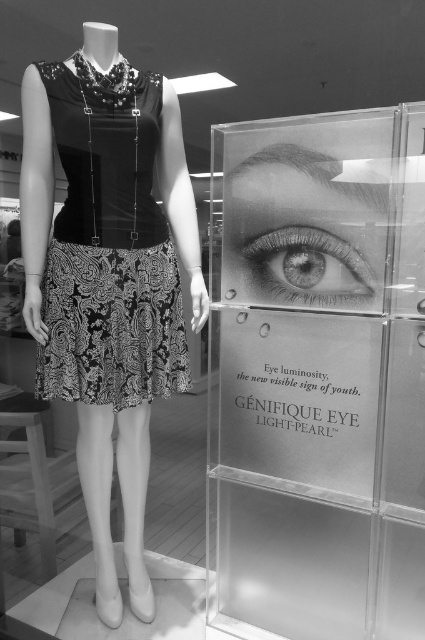
Question: Does transparent acrylic at right appear on the right side of black satin dress at center?

Choices:
 (A) yes
 (B) no

Answer: (A)

Question: Estimate the real-world distances between objects in this image. Which object is farther from the black satin dress at center?

Choices:
 (A) transparent acrylic at right
 (B) gray matte eye at center

Answer: (B)

Question: Estimate the real-world distances between objects in this image. Which object is farther from the black satin dress at center?

Choices:
 (A) gray matte eye at center
 (B) transparent acrylic at right

Answer: (A)

Question: Does black satin dress at center appear under gray matte eye at center?

Choices:
 (A) yes
 (B) no

Answer: (B)

Question: Does black satin dress at center appear under gray matte eye at center?

Choices:
 (A) no
 (B) yes

Answer: (A)

Question: Which point is farther to the camera?

Choices:
 (A) black satin dress at center
 (B) gray matte eye at center
 (C) transparent acrylic at right

Answer: (B)